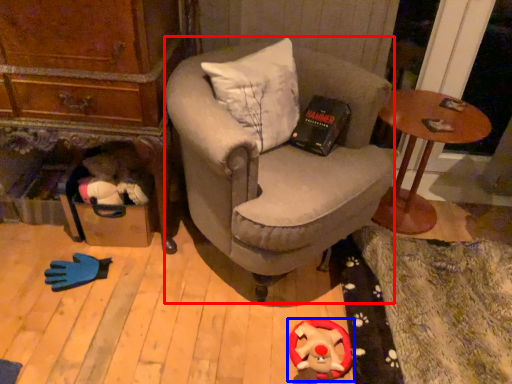
Question: Which point is further to the camera, chair (highlighted by a red box) or toy (highlighted by a blue box)?

Choices:
 (A) chair
 (B) toy

Answer: (B)